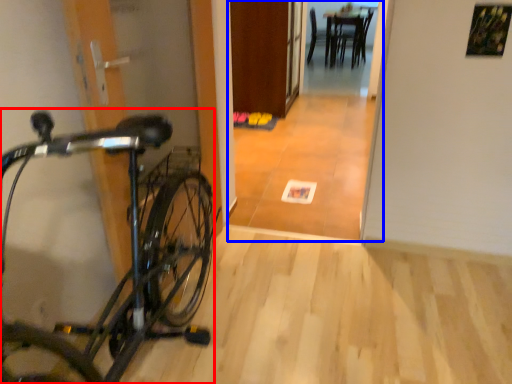
Question: Which object is closer to the camera taking this photo, bicycle (highlighted by a red box) or corridor (highlighted by a blue box)?

Choices:
 (A) bicycle
 (B) corridor

Answer: (A)